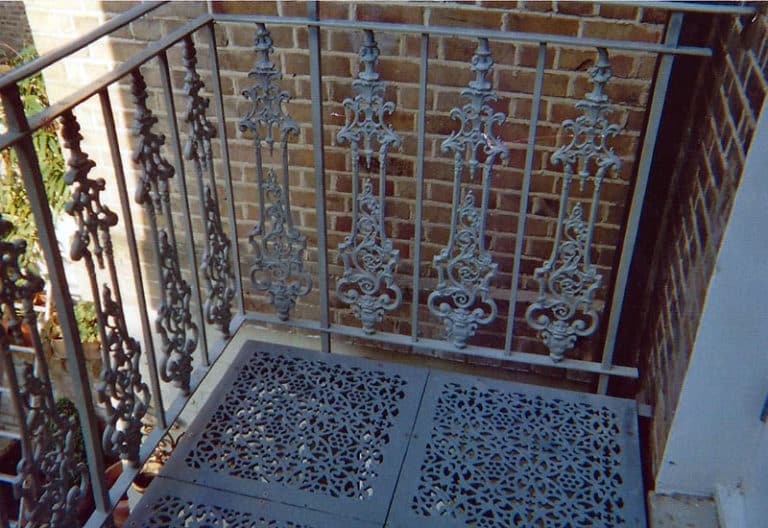
Find the location of `plant`. plant is located at coordinates (58, 156), (87, 320).